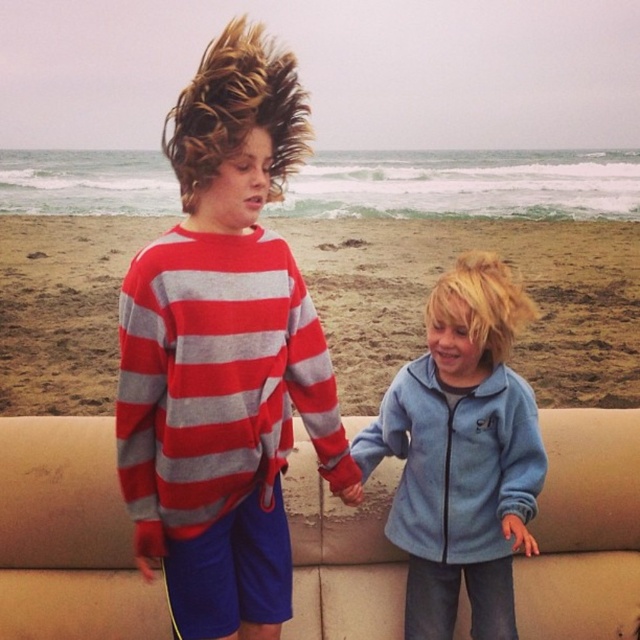
Which is more to the left, beige fabric couch at center or sandy beach at lower center?

From the viewer's perspective, sandy beach at lower center appears more on the left side.

Between point (294, 547) and point (44, 378), which one is positioned behind?

The point (44, 378) is behind.

Between point (77, 624) and point (35, 404), which one is positioned in front?

Point (77, 624) is more forward.

The width and height of the screenshot is (640, 640). I want to click on beige fabric couch at center, so click(67, 536).

This screenshot has height=640, width=640. What do you see at coordinates (225, 355) in the screenshot? I see `red and gray striped sweater at center` at bounding box center [225, 355].

Which is in front, point (244, 321) or point (372, 392)?

Positioned in front is point (244, 321).

Locate an element on the screen. red and gray striped sweater at center is located at coordinates (225, 355).

Does red and gray striped sweater at center come behind beige fabric couch at center?

No, red and gray striped sweater at center is in front of beige fabric couch at center.

Can you confirm if red and gray striped sweater at center is shorter than beige fabric couch at center?

Yes, red and gray striped sweater at center is shorter than beige fabric couch at center.

This screenshot has width=640, height=640. In order to click on red and gray striped sweater at center in this screenshot , I will do `click(225, 355)`.

I want to click on red and gray striped sweater at center, so click(225, 355).